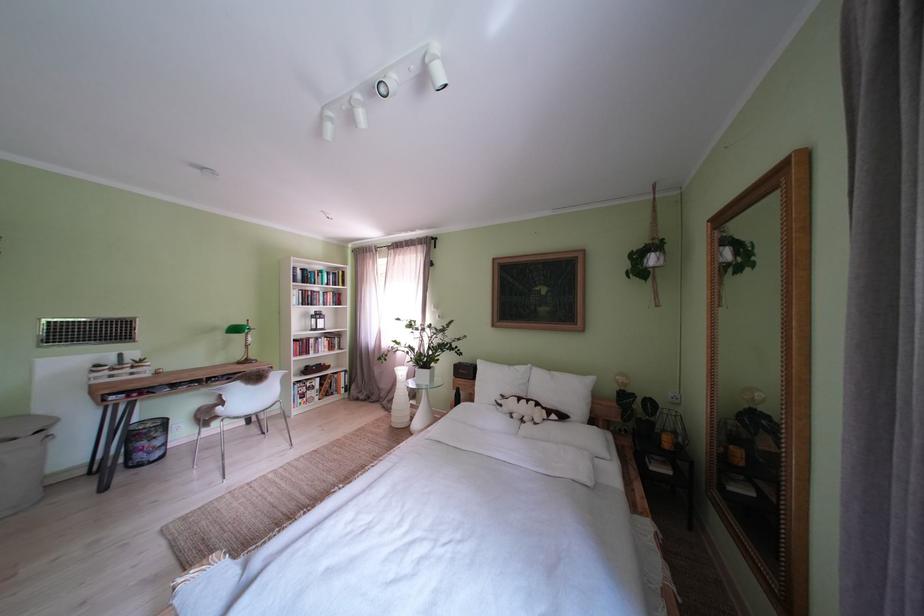
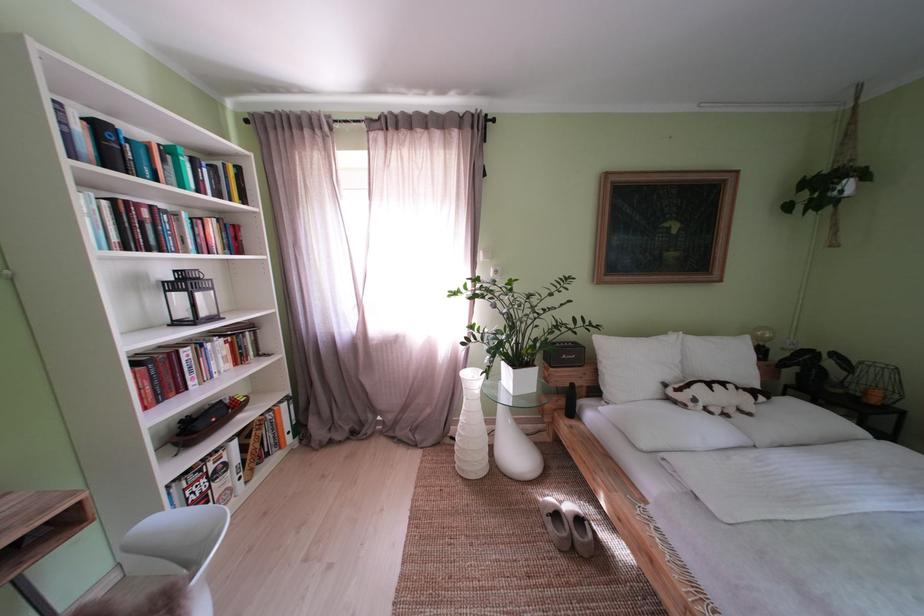
Where in the second image is the point corresponding to point (314, 276) from the first image?

(111, 132)